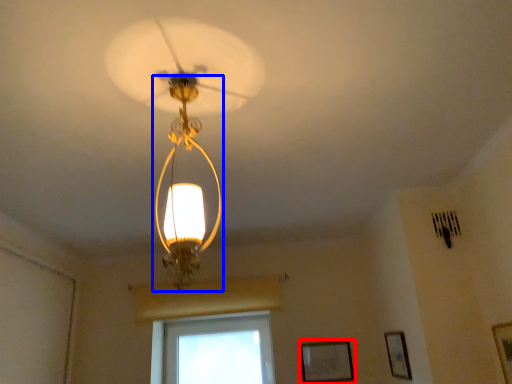
Question: Which object is further to the camera taking this photo, picture frame (highlighted by a red box) or light fixture (highlighted by a blue box)?

Choices:
 (A) picture frame
 (B) light fixture

Answer: (A)